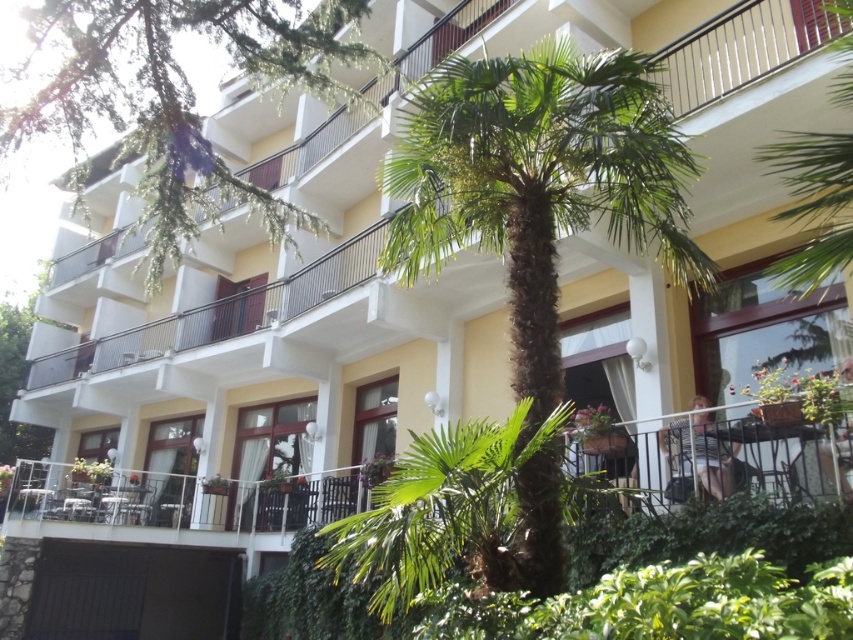
Describe the element at coordinates (538, 180) in the screenshot. I see `green leafy palm tree at center` at that location.

Is point (425, 269) less distant than point (146, 36)?

No, it is not.

You are a GUI agent. You are given a task and a screenshot of the screen. Output one action in this format:
    pyautogui.click(x=<x>, y=<y>)
    Task: Click on the green leafy palm tree at center
    Image resolution: width=853 pixels, height=640 pixels.
    Given the screenshot: What is the action you would take?
    pyautogui.click(x=538, y=180)